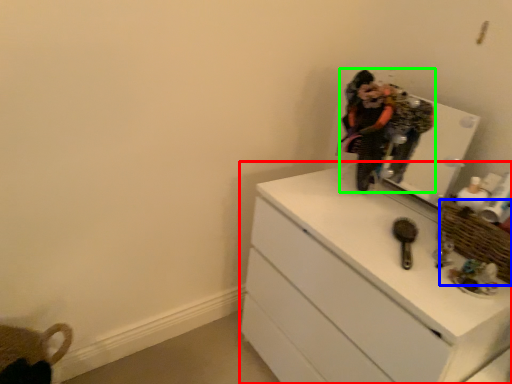
Question: Which object is the closest to the chest of drawers (highlighted by a red box)? Choose among these: basket (highlighted by a blue box) or person (highlighted by a green box).

Choices:
 (A) basket
 (B) person

Answer: (A)